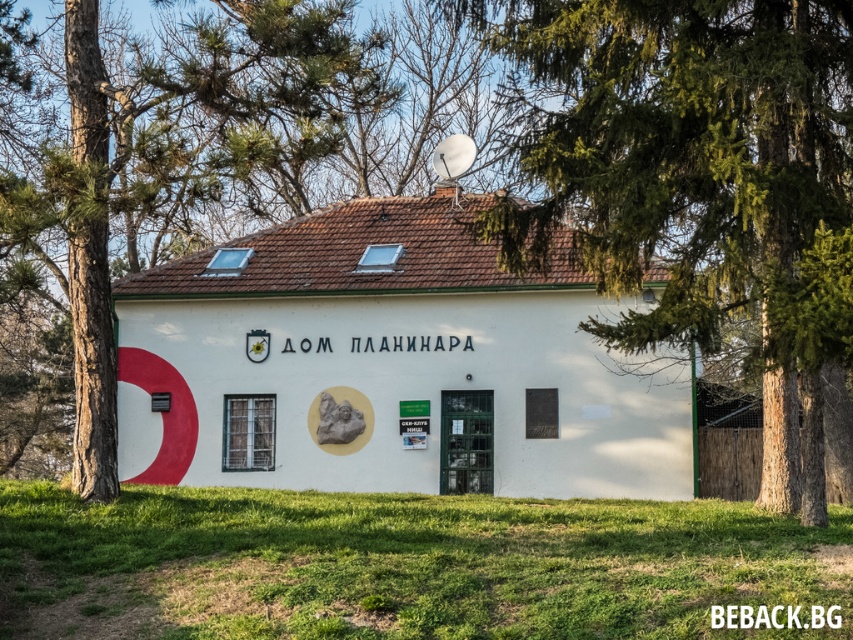
You are standing in front of the building and want to take a photo of the green textured tree at center without including the building in the frame. Is the tree far enough away from the building to allow you to step back and frame it properly?

The green textured tree at center is 15.34 meters away from the viewer. Since the tree is quite far from the building, you can step back enough to frame the tree without including the building in the photo.